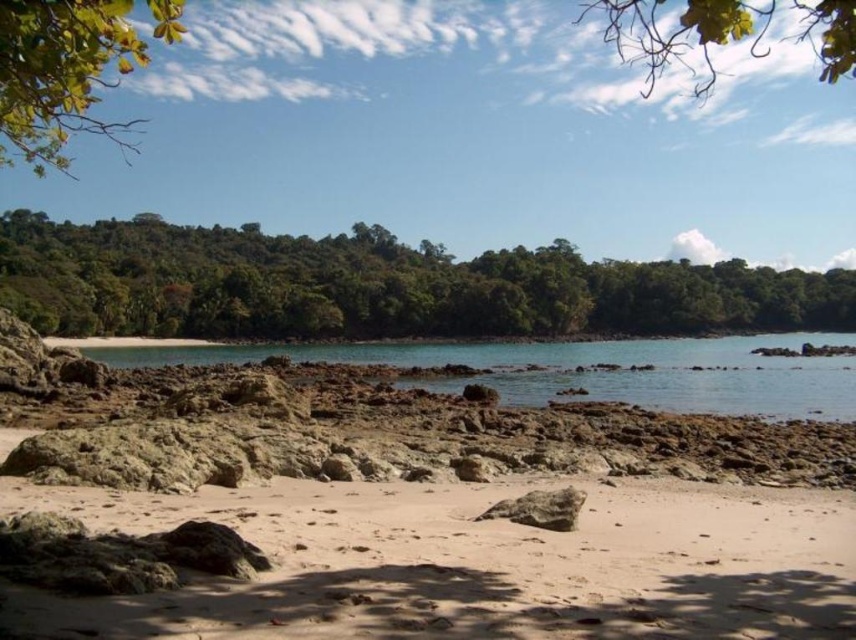
Question: Which point is farther to the camera?

Choices:
 (A) [759, 45]
 (B) [174, 230]
 (C) [663, 376]

Answer: (A)

Question: Is green leafy trees at center to the right of green leafy tree at upper center from the viewer's perspective?

Choices:
 (A) no
 (B) yes

Answer: (A)

Question: Which object is farther from the camera taking this photo?

Choices:
 (A) green leafy tree at upper center
 (B) green leafy trees at center
 (C) clear blue water at center

Answer: (B)

Question: Does green leafy trees at center have a smaller size compared to green leafy tree at upper left?

Choices:
 (A) yes
 (B) no

Answer: (A)

Question: Does clear blue water at center appear under green leafy tree at upper center?

Choices:
 (A) yes
 (B) no

Answer: (A)

Question: Which object is the farthest from the green leafy tree at upper center?

Choices:
 (A) clear blue water at center
 (B) green leafy tree at upper left
 (C) sandy beach at center

Answer: (B)